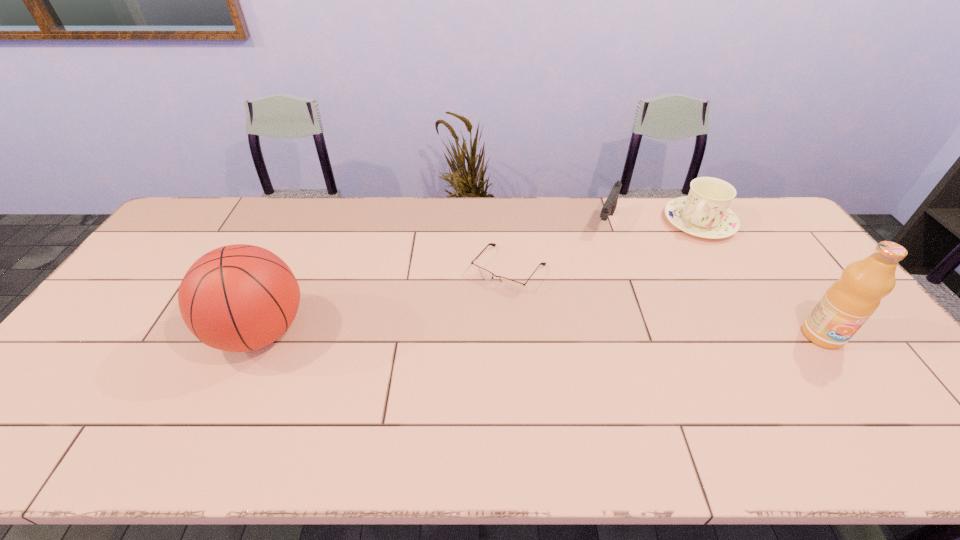
Find the location of a particular element. This screenshot has height=540, width=960. chinaware situated at the right edge is located at coordinates (704, 213).

Locate an element on the screen. object that is positioned at the far right corner is located at coordinates (704, 213).

You are a GUI agent. You are given a task and a screenshot of the screen. Output one action in this format:
    pyautogui.click(x=<x>, y=<y>)
    Task: Click on the vacant space at the far edge
    
    Given the screenshot: What is the action you would take?
    pyautogui.click(x=370, y=235)

This screenshot has width=960, height=540. Find the location of `vacant area at the near edge`. vacant area at the near edge is located at coordinates (441, 411).

What are the coordinates of `vacant space at the left edge of the desktop` in the screenshot? It's located at click(172, 256).

The height and width of the screenshot is (540, 960). What are the coordinates of `free space at the far right corner` in the screenshot? It's located at (768, 230).

You are a GUI agent. You are given a task and a screenshot of the screen. Output one action in this format:
    pyautogui.click(x=<x>, y=<y>)
    Task: Click on the vacant region at the near right corner of the desktop
    The width and height of the screenshot is (960, 540).
    Given the screenshot: What is the action you would take?
    pyautogui.click(x=868, y=398)

What are the coordinates of `empty space that is in between the chinaware and the pistol` in the screenshot? It's located at (653, 222).

You are a GUI agent. You are given a task and a screenshot of the screen. Output one action in this format:
    pyautogui.click(x=<x>, y=<y>)
    Task: Click on the free space between the leftmost object and the shortest object
    This screenshot has width=960, height=540.
    Given the screenshot: What is the action you would take?
    pyautogui.click(x=385, y=301)

At what (x,y) coordinates should I click in order to perform the action: click on free space between the fruit juice and the chinaware. Please return your answer as a coordinate pair (x, y). Image resolution: width=960 pixels, height=540 pixels. Looking at the image, I should click on (760, 279).